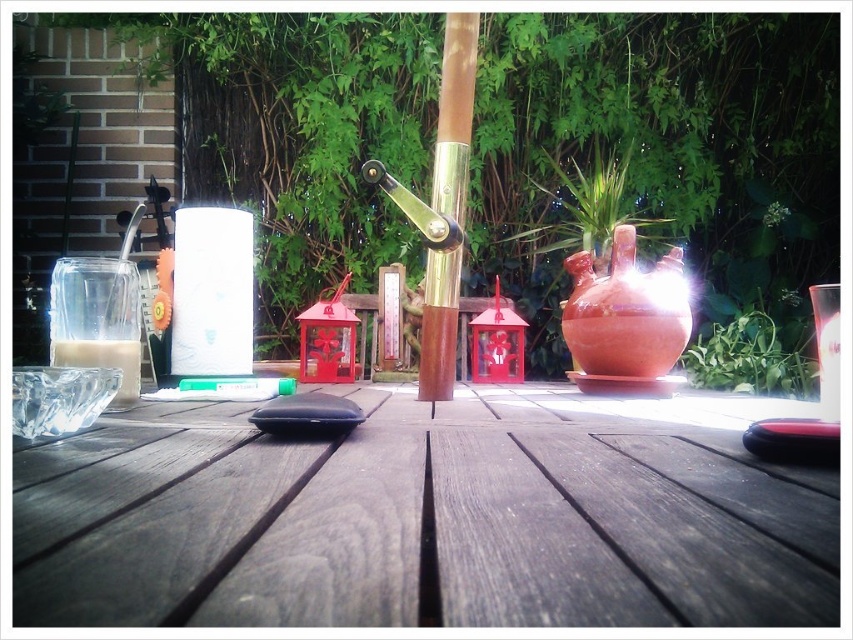
Question: Is matte terracotta pot at center to the left of green leafy plant at lower right from the viewer's perspective?

Choices:
 (A) yes
 (B) no

Answer: (A)

Question: Which of these objects is positioned farthest from the green leafy plant at lower right?

Choices:
 (A) matte terracotta pot at center
 (B) dark wood table at center

Answer: (B)

Question: From the image, what is the correct spatial relationship of matte terracotta pot at center in relation to green leafy plant at lower right?

Choices:
 (A) right
 (B) left

Answer: (B)

Question: Which point is farther to the camera?

Choices:
 (A) dark wood table at center
 (B) green leafy plant at lower right
 (C) matte terracotta pot at center

Answer: (C)

Question: Is matte terracotta pot at center in front of green leafy plant at lower right?

Choices:
 (A) no
 (B) yes

Answer: (A)

Question: Which object is positioned farthest from the dark wood table at center?

Choices:
 (A) green leafy plant at lower right
 (B) matte terracotta pot at center

Answer: (B)